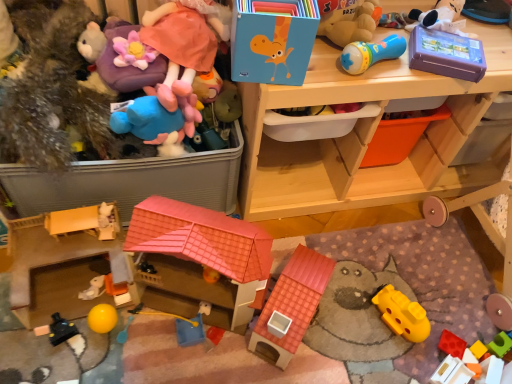
Identify the location of vacant region to the left of rubberized plastic microphone at upper right, arranged as the fourth toy when viewed from the right. The image size is (512, 384). (318, 64).